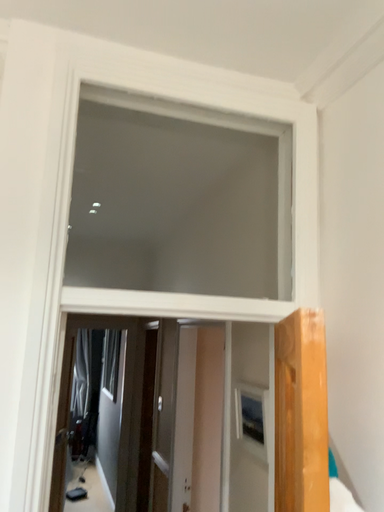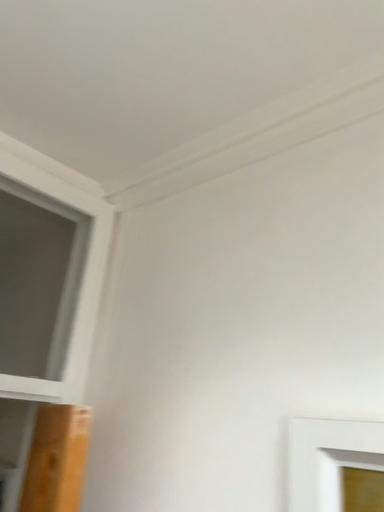
Question: How did the camera likely rotate when shooting the video?

Choices:
 (A) rotated left
 (B) rotated right

Answer: (B)